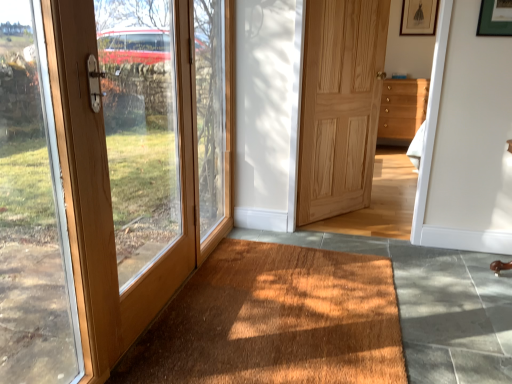
Question: Is natural wood door at center, the 2th door positioned from the left, next to wooden door at left?

Choices:
 (A) no
 (B) yes

Answer: (A)

Question: Does natural wood door at center, the 2th door positioned from the left, have a greater width compared to wooden door at left?

Choices:
 (A) yes
 (B) no

Answer: (A)

Question: Is natural wood door at center, the 2th door positioned from the left, to the right of wooden door at left from the viewer's perspective?

Choices:
 (A) yes
 (B) no

Answer: (A)

Question: From a real-world perspective, is natural wood door at center, marked as the first door in a back-to-front arrangement, located higher than wooden door at left?

Choices:
 (A) no
 (B) yes

Answer: (B)

Question: Is the depth of natural wood door at center, the 2th door positioned from the left, less than that of wooden door at left?

Choices:
 (A) yes
 (B) no

Answer: (B)

Question: Does natural wood door at center, the 2th door positioned from the left, have a lesser width compared to wooden door at left?

Choices:
 (A) no
 (B) yes

Answer: (A)

Question: Is matte black picture frame at upper right looking in the opposite direction of wooden chest of drawers at center-right?

Choices:
 (A) no
 (B) yes

Answer: (A)

Question: Considering the relative sizes of matte black picture frame at upper right and wooden chest of drawers at center-right in the image provided, is matte black picture frame at upper right thinner than wooden chest of drawers at center-right?

Choices:
 (A) yes
 (B) no

Answer: (A)

Question: Considering the relative sizes of matte black picture frame at upper right and wooden chest of drawers at center-right in the image provided, is matte black picture frame at upper right smaller than wooden chest of drawers at center-right?

Choices:
 (A) yes
 (B) no

Answer: (A)

Question: From the image's perspective, is matte black picture frame at upper right on top of wooden chest of drawers at center-right?

Choices:
 (A) yes
 (B) no

Answer: (A)

Question: Is the position of matte black picture frame at upper right more distant than that of wooden chest of drawers at center-right?

Choices:
 (A) no
 (B) yes

Answer: (B)

Question: Is wooden chest of drawers at center-right a part of matte black picture frame at upper right?

Choices:
 (A) no
 (B) yes

Answer: (A)

Question: Does matte wood door at left, placed as the 1th door when sorted from front to back, appear on the right side of wooden chest of drawers at center-right?

Choices:
 (A) no
 (B) yes

Answer: (A)